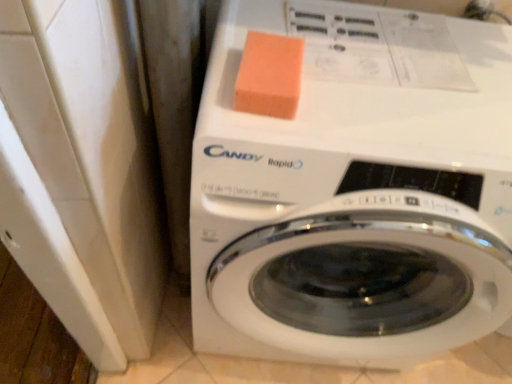
Image resolution: width=512 pixels, height=384 pixels. I want to click on spots to the right of orange sponge at upper center, so click(372, 95).